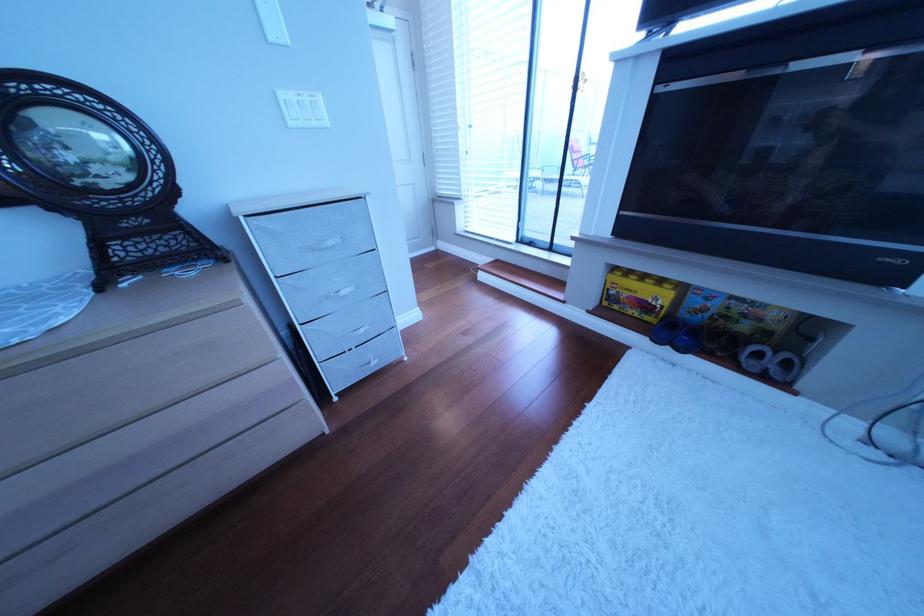
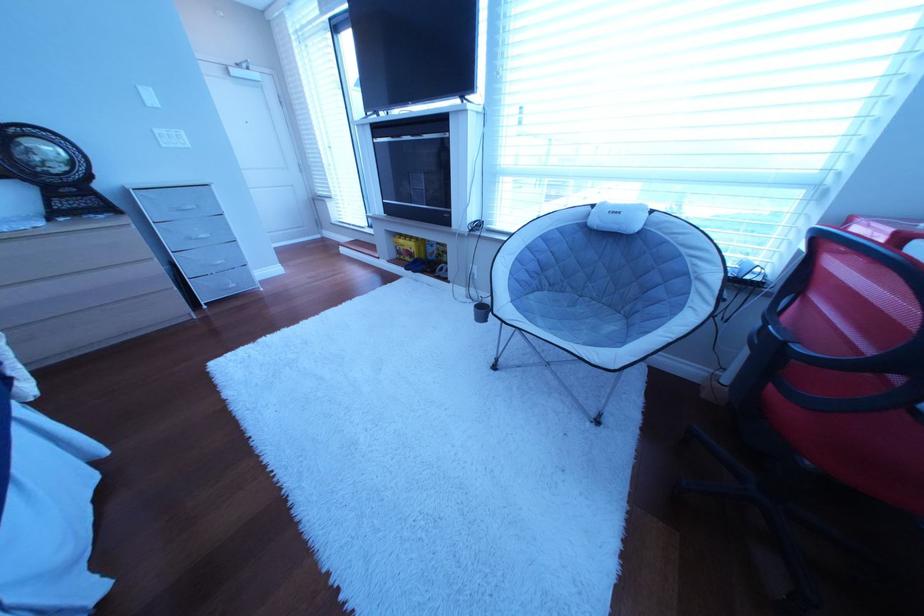
In the second image, find the point that corresponds to point 307,126 in the first image.

(179, 148)